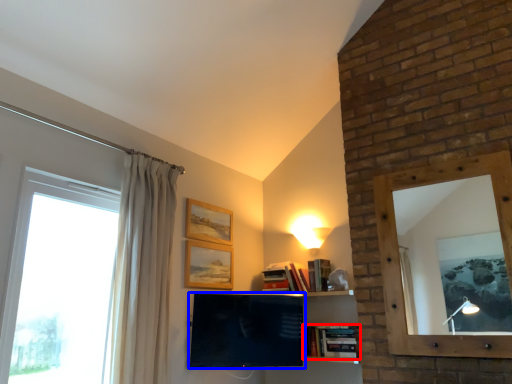
Question: Which object is closer to the camera taking this photo, book (highlighted by a red box) or television (highlighted by a blue box)?

Choices:
 (A) book
 (B) television

Answer: (B)